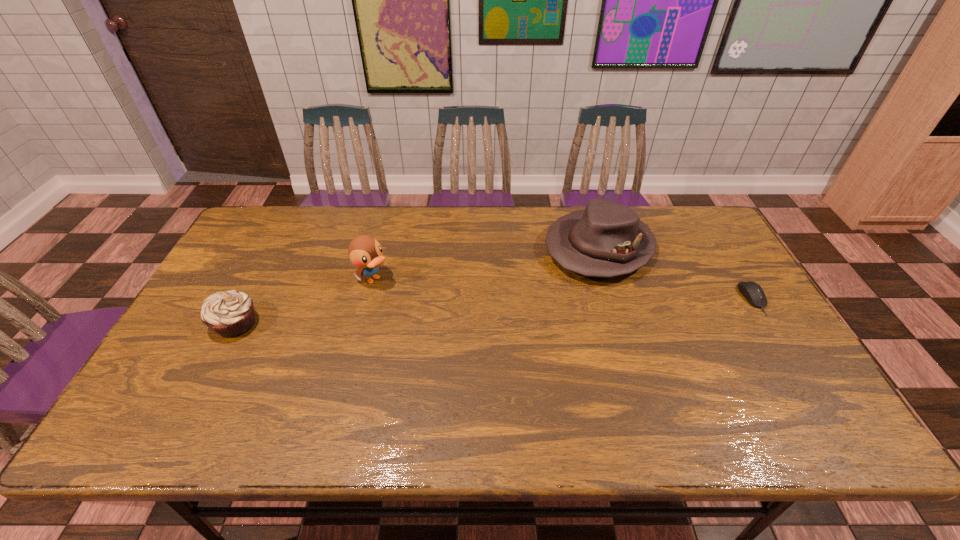
You are a GUI agent. You are given a task and a screenshot of the screen. Output one action in this format:
    pyautogui.click(x=<x>, y=<y>)
    Task: Click on the vacant space on the desktop that is between the muffin and the computer mouse and is positioned on the decorative side of the hat
    
    Given the screenshot: What is the action you would take?
    click(x=521, y=310)

The image size is (960, 540). Find the location of `vacant space on the desktop that is between the leftmost object and the shortest object and is positioned on the front-facing side of the duck`. vacant space on the desktop that is between the leftmost object and the shortest object and is positioned on the front-facing side of the duck is located at coordinates (425, 315).